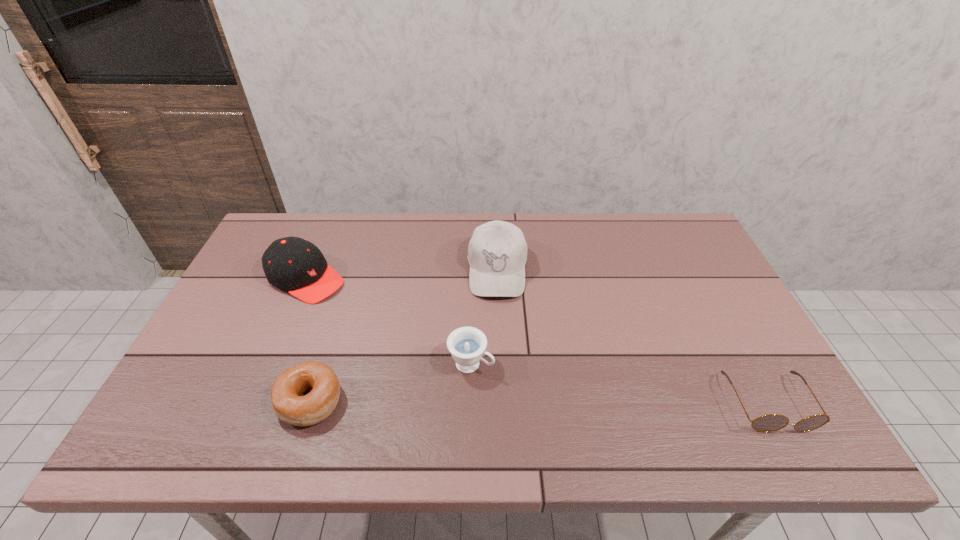
At what (x,y) coordinates should I click in order to perform the action: click on object situated at the left edge. Please return your answer as a coordinate pair (x, y). The width and height of the screenshot is (960, 540). Looking at the image, I should click on (293, 264).

Locate an element on the screen. The height and width of the screenshot is (540, 960). object that is at the right edge is located at coordinates (772, 422).

At what (x,y) coordinates should I click in order to perform the action: click on object that is positioned at the far left corner. Please return your answer as a coordinate pair (x, y). The height and width of the screenshot is (540, 960). Looking at the image, I should click on (293, 264).

Where is `object that is at the near right corner`? The height and width of the screenshot is (540, 960). object that is at the near right corner is located at coordinates (772, 422).

The image size is (960, 540). I want to click on free space at the far edge, so click(610, 228).

The width and height of the screenshot is (960, 540). Identify the location of free location at the near edge of the desktop. (586, 397).

In the image, there is a desktop. Identify the location of vacant space at the left edge. (252, 286).

You are a GUI agent. You are given a task and a screenshot of the screen. Output one action in this format:
    pyautogui.click(x=<x>, y=<y>)
    Task: Click on the free location at the right edge
    The image size is (960, 540).
    Given the screenshot: What is the action you would take?
    pyautogui.click(x=705, y=266)

Where is `vacant space at the near left corner`? vacant space at the near left corner is located at coordinates (205, 409).

At what (x,y) coordinates should I click in order to perform the action: click on vacant region at the far right corner. Please return your answer as a coordinate pair (x, y). The width and height of the screenshot is (960, 540). Looking at the image, I should click on point(643,215).